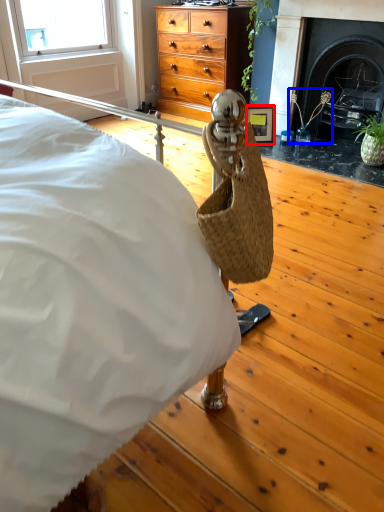
Question: Which of the following is the closest to the observer, picture frame (highlighted by a red box) or plant (highlighted by a blue box)?

Choices:
 (A) picture frame
 (B) plant

Answer: (B)